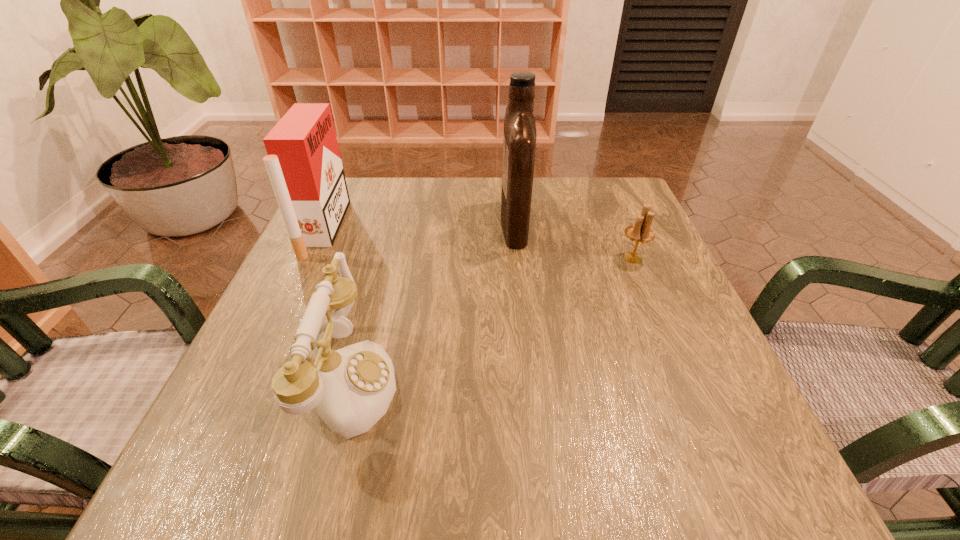
This screenshot has height=540, width=960. In order to click on object that is at the far left corner in this screenshot , I will do click(x=304, y=165).

The height and width of the screenshot is (540, 960). In order to click on object present at the near left corner in this screenshot , I will do `click(352, 387)`.

You are a GUI agent. You are given a task and a screenshot of the screen. Output one action in this format:
    pyautogui.click(x=<x>, y=<y>)
    Task: Click on the vacant space at the far edge of the desktop
    This screenshot has height=540, width=960.
    Given the screenshot: What is the action you would take?
    pyautogui.click(x=537, y=180)

Locate an element on the screen. The height and width of the screenshot is (540, 960). free space at the near edge of the desktop is located at coordinates (467, 491).

You are a GUI agent. You are given a task and a screenshot of the screen. Output one action in this format:
    pyautogui.click(x=<x>, y=<y>)
    Task: Click on the free space at the left edge
    The width and height of the screenshot is (960, 540).
    Given the screenshot: What is the action you would take?
    pyautogui.click(x=349, y=233)

Locate an element on the screen. This screenshot has height=540, width=960. free region at the right edge of the desktop is located at coordinates (611, 237).

This screenshot has height=540, width=960. Find the location of `free point at the far left corner`. free point at the far left corner is located at coordinates (384, 195).

Where is `vacant space at the far right corner`? vacant space at the far right corner is located at coordinates (x=636, y=213).

Identify the location of free space between the second shortest object and the liquor. (432, 302).

Image resolution: width=960 pixels, height=540 pixels. Identify the location of free space that is in between the third shortest object and the tallest object. (419, 226).